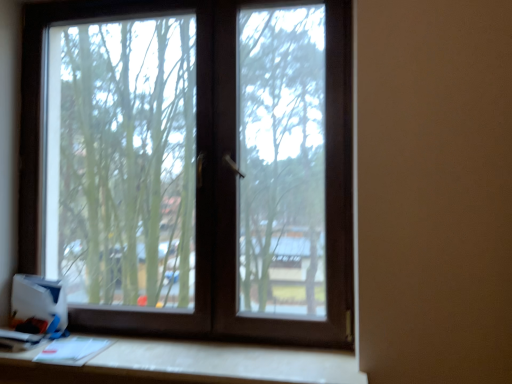
Question: From the image's perspective, is brown matte window at center over white cardboard box at lower left?

Choices:
 (A) yes
 (B) no

Answer: (A)

Question: Is brown matte window at center looking in the opposite direction of white cardboard box at lower left?

Choices:
 (A) yes
 (B) no

Answer: (A)

Question: From a real-world perspective, is brown matte window at center located beneath white cardboard box at lower left?

Choices:
 (A) yes
 (B) no

Answer: (B)

Question: Could you tell me if brown matte window at center is facing white cardboard box at lower left?

Choices:
 (A) yes
 (B) no

Answer: (A)

Question: Are brown matte window at center and white cardboard box at lower left located far from each other?

Choices:
 (A) yes
 (B) no

Answer: (B)

Question: Is brown matte window at center at the left side of white cardboard box at lower left?

Choices:
 (A) no
 (B) yes

Answer: (A)

Question: Is white cardboard box at lower left taller than white matte table at lower center?

Choices:
 (A) no
 (B) yes

Answer: (B)

Question: Does white cardboard box at lower left come in front of white matte table at lower center?

Choices:
 (A) yes
 (B) no

Answer: (B)

Question: Does white cardboard box at lower left have a lesser width compared to white matte table at lower center?

Choices:
 (A) yes
 (B) no

Answer: (A)

Question: Considering the relative sizes of white cardboard box at lower left and white matte table at lower center in the image provided, is white cardboard box at lower left shorter than white matte table at lower center?

Choices:
 (A) yes
 (B) no

Answer: (B)

Question: Is white cardboard box at lower left wider than white matte table at lower center?

Choices:
 (A) yes
 (B) no

Answer: (B)

Question: From the image's perspective, is white cardboard box at lower left located above white matte table at lower center?

Choices:
 (A) no
 (B) yes

Answer: (B)

Question: Is brown matte window at center shorter than white matte table at lower center?

Choices:
 (A) yes
 (B) no

Answer: (B)